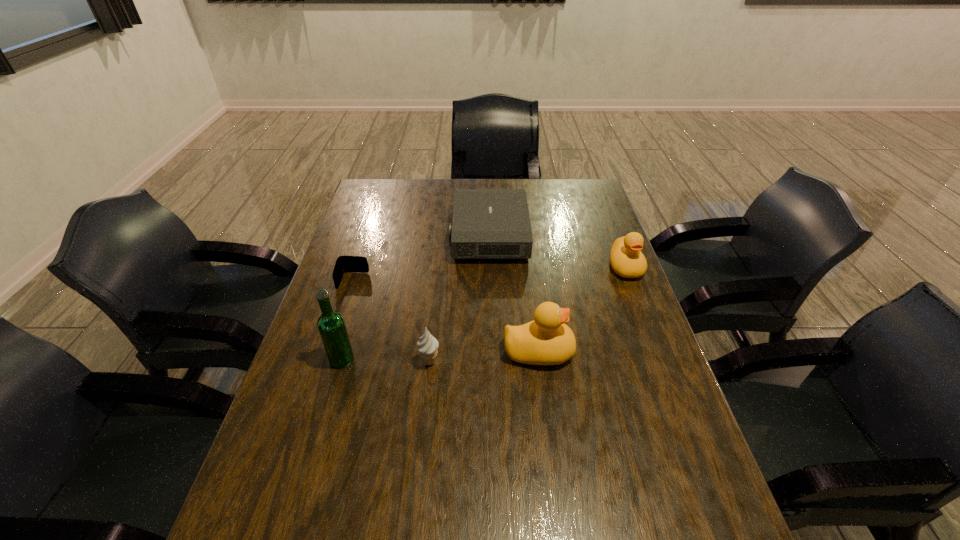
Find the location of `blank area in the image that satisfies the following two spatial constraints: 1. on the front-facing side of the fifth tallest object; 2. on the outer surface of the wallet`. blank area in the image that satisfies the following two spatial constraints: 1. on the front-facing side of the fifth tallest object; 2. on the outer surface of the wallet is located at coordinates (491, 281).